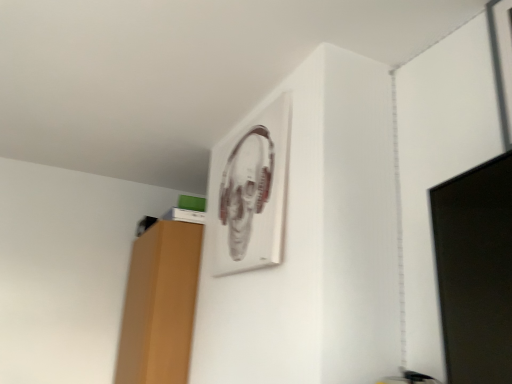
Question: Considering the positions of black glossy monitor at right and metallic silver picture frame at upper center in the image, is black glossy monitor at right taller or shorter than metallic silver picture frame at upper center?

Choices:
 (A) tall
 (B) short

Answer: (B)

Question: From a real-world perspective, relative to metallic silver picture frame at upper center, is black glossy monitor at right vertically above or below?

Choices:
 (A) below
 (B) above

Answer: (A)

Question: Looking at the image, does black glossy monitor at right seem bigger or smaller compared to metallic silver picture frame at upper center?

Choices:
 (A) big
 (B) small

Answer: (A)

Question: In terms of width, does metallic silver picture frame at upper center look wider or thinner when compared to black glossy monitor at right?

Choices:
 (A) thin
 (B) wide

Answer: (A)

Question: In the image, is metallic silver picture frame at upper center positioned in front of or behind black glossy monitor at right?

Choices:
 (A) behind
 (B) front

Answer: (A)

Question: From a real-world perspective, is metallic silver picture frame at upper center positioned above or below black glossy monitor at right?

Choices:
 (A) above
 (B) below

Answer: (A)

Question: Based on their positions, is metallic silver picture frame at upper center located to the left or right of black glossy monitor at right?

Choices:
 (A) left
 (B) right

Answer: (A)